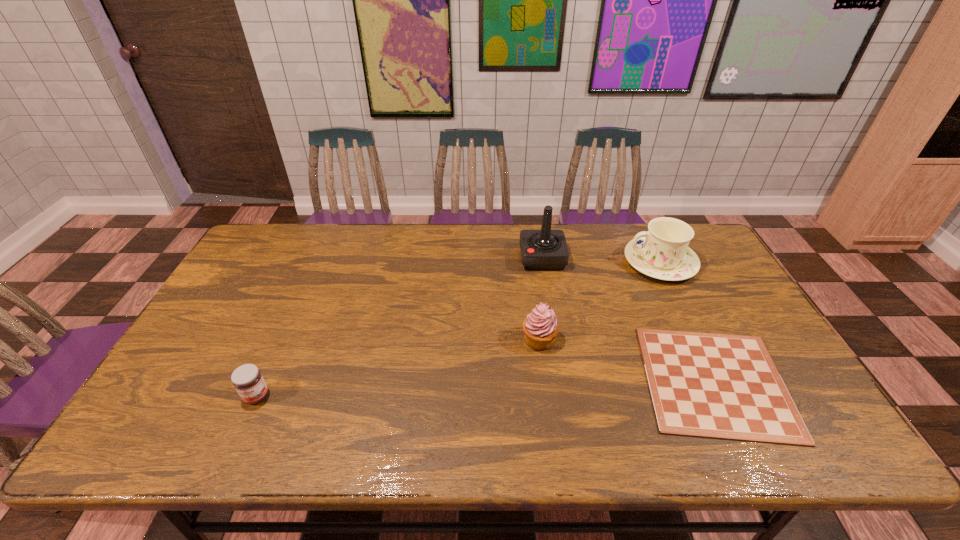
At what (x,y) coordinates should I click in order to perform the action: click on object that is at the far right corner. Please return your answer as a coordinate pair (x, y). The height and width of the screenshot is (540, 960). Looking at the image, I should click on (662, 252).

Find the location of a particular element. The image size is (960, 540). object positioned at the near right corner is located at coordinates (719, 386).

What are the coordinates of `vacant region at the far edge of the desktop` in the screenshot? It's located at (471, 251).

This screenshot has height=540, width=960. In the image, there is a desktop. Identify the location of vacant space at the near edge. (488, 443).

Where is `vacant space at the left edge of the desktop`? The width and height of the screenshot is (960, 540). vacant space at the left edge of the desktop is located at coordinates (221, 355).

The image size is (960, 540). In order to click on vacant region at the right edge of the desktop in this screenshot , I will do `click(698, 292)`.

Where is `vacant space at the near left corner`? vacant space at the near left corner is located at coordinates (157, 454).

Locate an element on the screen. The width and height of the screenshot is (960, 540). blank space at the far right corner is located at coordinates (708, 259).

Locate an element on the screen. This screenshot has width=960, height=540. vacant space that's between the chinaware and the leftmost object is located at coordinates (458, 329).

Find the location of a particular element. The image size is (960, 540). free space between the joystick and the cupcake is located at coordinates (540, 299).